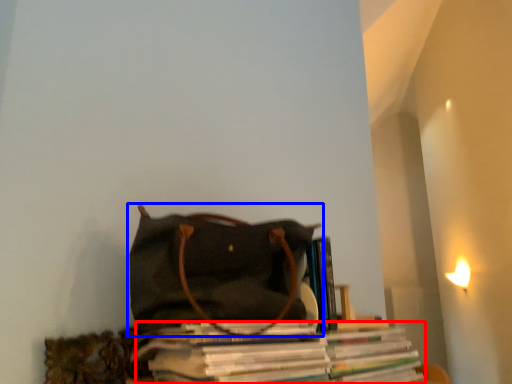
Question: Which object appears farthest to the camera in this image, magazine (highlighted by a red box) or handbag (highlighted by a blue box)?

Choices:
 (A) magazine
 (B) handbag

Answer: (B)